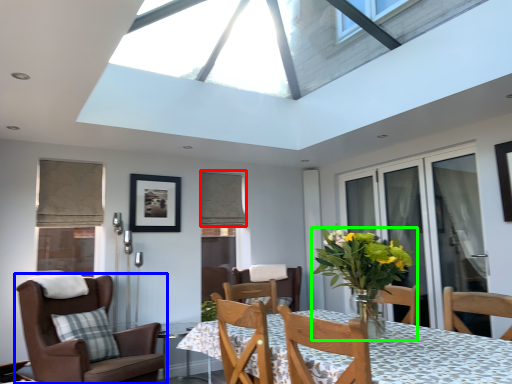
Question: Which is nearer to the curtain (highlighted by a red box)? chair (highlighted by a blue box) or houseplant (highlighted by a green box).

Choices:
 (A) chair
 (B) houseplant

Answer: (A)